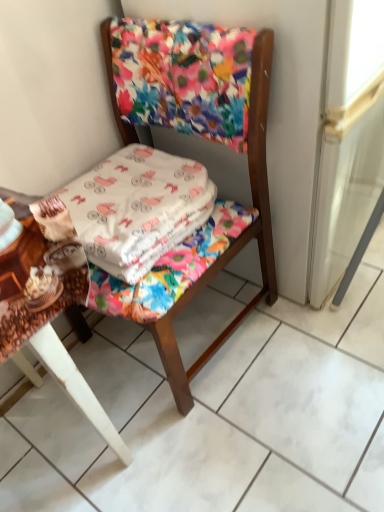
What do you see at coordinates (130, 209) in the screenshot? The image size is (384, 512). I see `white cotton blanket at center` at bounding box center [130, 209].

The image size is (384, 512). What do you see at coordinates (279, 113) in the screenshot?
I see `floral fabric screen door at upper center` at bounding box center [279, 113].

Locate an element on the screen. The width and height of the screenshot is (384, 512). white cotton blanket at center is located at coordinates (130, 209).

Find the location of `screen door lying on the right of wooden table at lower left`. screen door lying on the right of wooden table at lower left is located at coordinates (279, 113).

Is wooden table at lower left located outside floral fabric screen door at upper center?

Indeed, wooden table at lower left is completely outside floral fabric screen door at upper center.

Can you confirm if wooden table at lower left is bigger than floral fabric screen door at upper center?

No, wooden table at lower left is not bigger than floral fabric screen door at upper center.

Is wooden table at lower left turned away from floral fabric screen door at upper center?

No, wooden table at lower left is not facing away from floral fabric screen door at upper center.

From a real-world perspective, between white cotton blanket at center and floral fabric screen door at upper center, who is vertically higher?

In real-world perspective, white cotton blanket at center is above.

Does point (61, 212) appear closer or farther from the camera than point (280, 32)?

Point (61, 212) is positioned closer to the camera compared to point (280, 32).

Are white cotton blanket at center and floral fabric screen door at upper center located far from each other?

white cotton blanket at center is near floral fabric screen door at upper center, not far away.

Would you say white cotton blanket at center contains floral fabric screen door at upper center?

Actually, floral fabric screen door at upper center is outside white cotton blanket at center.

Between floral fabric screen door at upper center and white cotton blanket at center, which one has more height?

Standing taller between the two is floral fabric screen door at upper center.

Looking at their sizes, would you say floral fabric screen door at upper center is wider or thinner than white cotton blanket at center?

floral fabric screen door at upper center is wider than white cotton blanket at center.

Is point (287, 137) positioned after point (103, 204)?

No.

Between floral fabric chair at center and floral fabric screen door at upper center, which one has larger size?

Bigger between the two is floral fabric screen door at upper center.

Which is in front, point (219, 269) or point (295, 166)?

The point (219, 269) is closer to the camera.

From a real-world perspective, who is located higher, floral fabric chair at center or floral fabric screen door at upper center?

From a 3D spatial view, floral fabric screen door at upper center is above.

In the scene shown: From the image's perspective, would you say floral fabric chair at center is shown under floral fabric screen door at upper center?

Correct, floral fabric chair at center appears lower than floral fabric screen door at upper center in the image.

Is white cotton blanket at center facing away from floral fabric chair at center?

Yes, floral fabric chair at center is at the back of white cotton blanket at center.

Considering the sizes of white cotton blanket at center and floral fabric chair at center in the image, is white cotton blanket at center bigger or smaller than floral fabric chair at center?

Considering their sizes, white cotton blanket at center takes up less space than floral fabric chair at center.

Is white cotton blanket at center completely or partially outside of floral fabric chair at center?

No, white cotton blanket at center is inside floral fabric chair at center's boundary.

Does white cotton blanket at center have a greater width compared to floral fabric chair at center?

Incorrect, the width of white cotton blanket at center does not surpass that of floral fabric chair at center.

Is floral fabric chair at center completely or partially inside floral fabric screen door at upper center?

No, floral fabric screen door at upper center does not contain floral fabric chair at center.

Does floral fabric screen door at upper center turn towards floral fabric chair at center?

No, floral fabric screen door at upper center is not turned towards floral fabric chair at center.

Which of these two, floral fabric screen door at upper center or floral fabric chair at center, is bigger?

With larger size is floral fabric screen door at upper center.

How distant is floral fabric screen door at upper center from floral fabric chair at center?

They are 5.09 inches apart.

Is floral fabric chair at center to the right of white cotton blanket at center from the viewer's perspective?

Correct, you'll find floral fabric chair at center to the right of white cotton blanket at center.

From a real-world perspective, does floral fabric chair at center sit lower than white cotton blanket at center?

Indeed, from a real-world perspective, floral fabric chair at center is positioned beneath white cotton blanket at center.

Is floral fabric chair at center positioned with its back to white cotton blanket at center?

Correct, floral fabric chair at center is looking away from white cotton blanket at center.

Identify the location of screen door above the wooden table at lower left (from a real-world perspective). Image resolution: width=384 pixels, height=512 pixels. (279, 113).

Locate an element on the screen. The width and height of the screenshot is (384, 512). screen door on the right of the white cotton blanket at center is located at coordinates (279, 113).

From the picture: From the image, which object appears to be nearer to floral fabric chair at center, wooden table at lower left or white cotton blanket at center?

The object closer to floral fabric chair at center is white cotton blanket at center.

From the picture: Based on their spatial positions, is floral fabric chair at center or floral fabric screen door at upper center closer to wooden table at lower left?

Among the two, floral fabric chair at center is located nearer to wooden table at lower left.

When comparing their distances from floral fabric chair at center, does floral fabric screen door at upper center or wooden table at lower left seem closer?

floral fabric screen door at upper center lies closer to floral fabric chair at center than the other object.

From the picture: Considering their positions, is floral fabric chair at center positioned further to floral fabric screen door at upper center than white cotton blanket at center?

Based on the image, white cotton blanket at center appears to be further to floral fabric screen door at upper center.

Estimate the real-world distances between objects in this image. Which object is closer to floral fabric chair at center, floral fabric screen door at upper center or white cotton blanket at center?

Among the two, floral fabric screen door at upper center is located nearer to floral fabric chair at center.

When comparing their distances from floral fabric chair at center, does wooden table at lower left or floral fabric screen door at upper center seem closer?

floral fabric screen door at upper center is positioned closer to the anchor floral fabric chair at center.

Estimate the real-world distances between objects in this image. Which object is further from wooden table at lower left, white cotton blanket at center or floral fabric chair at center?

white cotton blanket at center lies further to wooden table at lower left than the other object.

When comparing their distances from white cotton blanket at center, does wooden table at lower left or floral fabric chair at center seem further?

wooden table at lower left is positioned further to the anchor white cotton blanket at center.

This screenshot has width=384, height=512. In order to click on chair located between wooden table at lower left and floral fabric screen door at upper center in the left-right direction in this screenshot , I will do `click(234, 240)`.

The height and width of the screenshot is (512, 384). Identify the location of chair between wooden table at lower left and white cotton blanket at center from front to back. (234, 240).

Where is `blanket located between wooden table at lower left and floral fabric screen door at upper center in the left-right direction`? The width and height of the screenshot is (384, 512). blanket located between wooden table at lower left and floral fabric screen door at upper center in the left-right direction is located at coordinates (130, 209).

Find the location of a particular element. chair situated between white cotton blanket at center and floral fabric screen door at upper center from left to right is located at coordinates (234, 240).